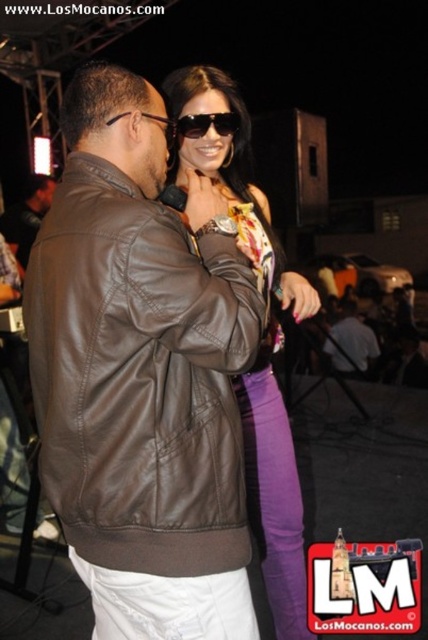
You are a photographer at the event and want to capture a closeup shot of both the shiny purple jeans at center and the black plastic sunglasses at upper center. Since you can only focus on one object at a time, which one should you choose to ensure the other is still in the background?

The shiny purple jeans at center is taller than the black plastic sunglasses at upper center, so focusing on the shiny purple jeans at center will ensure the sunglasses are still in the background.

You are a photographer at this event and need to adjust your camera focus. The brown leather jacket at left and the black plastic sunglasses at upper center are both in the frame. Which object should you focus on first if you want to capture both clearly?

The brown leather jacket at left is much taller than the black plastic sunglasses at upper center, so focusing on the taller object first would ensure both are in focus.